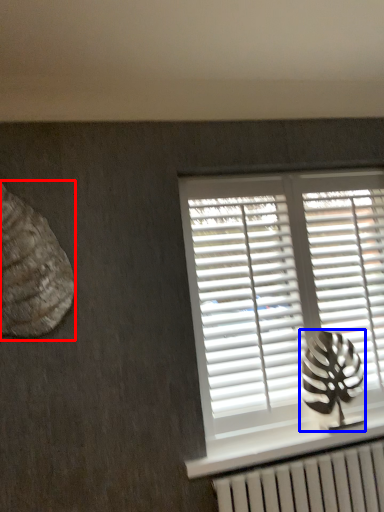
Question: Which object is closer to the camera taking this photo, animal (highlighted by a red box) or animal (highlighted by a blue box)?

Choices:
 (A) animal
 (B) animal

Answer: (A)